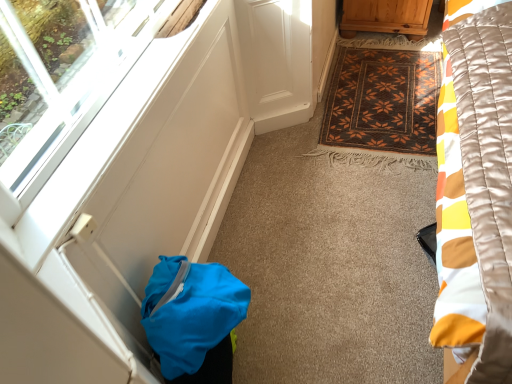
The image size is (512, 384). What are the coordinates of `free location in front of brown woven mat at center` in the screenshot? It's located at (337, 234).